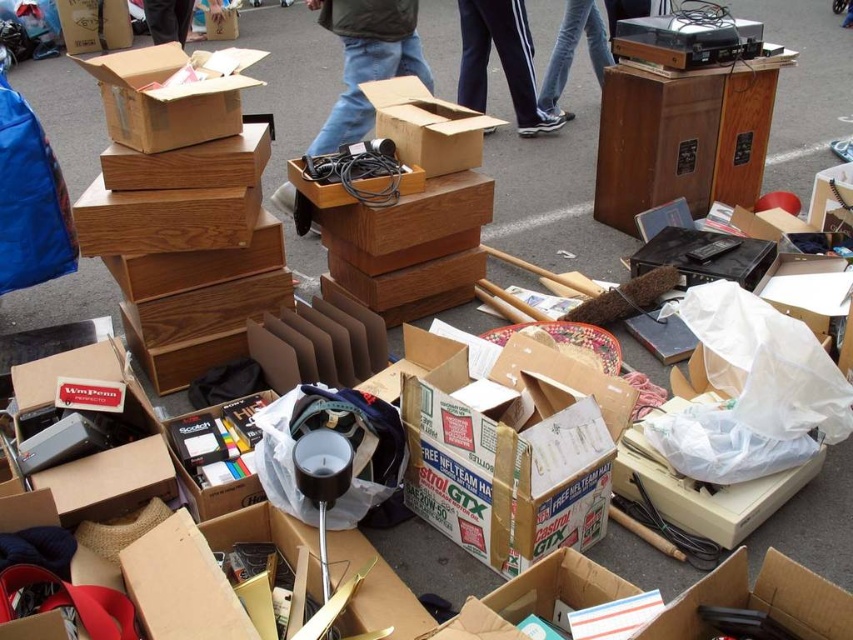
Can you confirm if matte brown box at center is smaller than wooden box at center?

Incorrect, matte brown box at center is not smaller in size than wooden box at center.

Which is below, matte brown box at center or wooden box at center?

matte brown box at center

This screenshot has height=640, width=853. Describe the element at coordinates (94, 24) in the screenshot. I see `matte brown box at center` at that location.

Find the location of a particular element. This screenshot has width=853, height=640. matte brown box at center is located at coordinates (94, 24).

Is dark blue jeans at center thinner than wooden box at center?

In fact, dark blue jeans at center might be wider than wooden box at center.

Does point (473, 76) come farther from viewer compared to point (227, 28)?

No, it is not.

The height and width of the screenshot is (640, 853). In order to click on dark blue jeans at center in this screenshot , I will do `click(500, 60)`.

At what (x,y) coordinates should I click in order to perform the action: click on cardboard box at center. Please return your answer as a coordinate pair (x, y). The image size is (853, 640). Looking at the image, I should click on (167, 97).

Between point (236, 76) and point (106, 45), which one is positioned in front?

Point (236, 76)

Find the location of a particular element. The height and width of the screenshot is (640, 853). cardboard box at center is located at coordinates (167, 97).